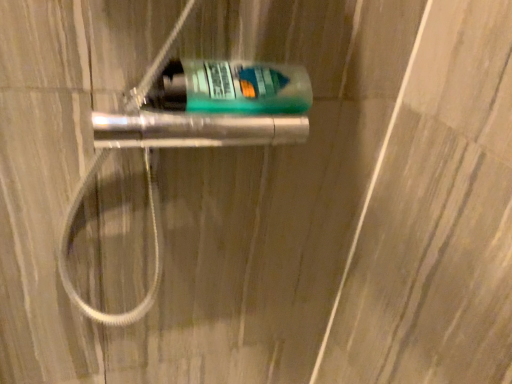
Identify the location of green matte bottle at center. (231, 88).

What do you see at coordinates (231, 88) in the screenshot? The width and height of the screenshot is (512, 384). I see `green matte bottle at center` at bounding box center [231, 88].

Identify the location of green matte bottle at center. (231, 88).